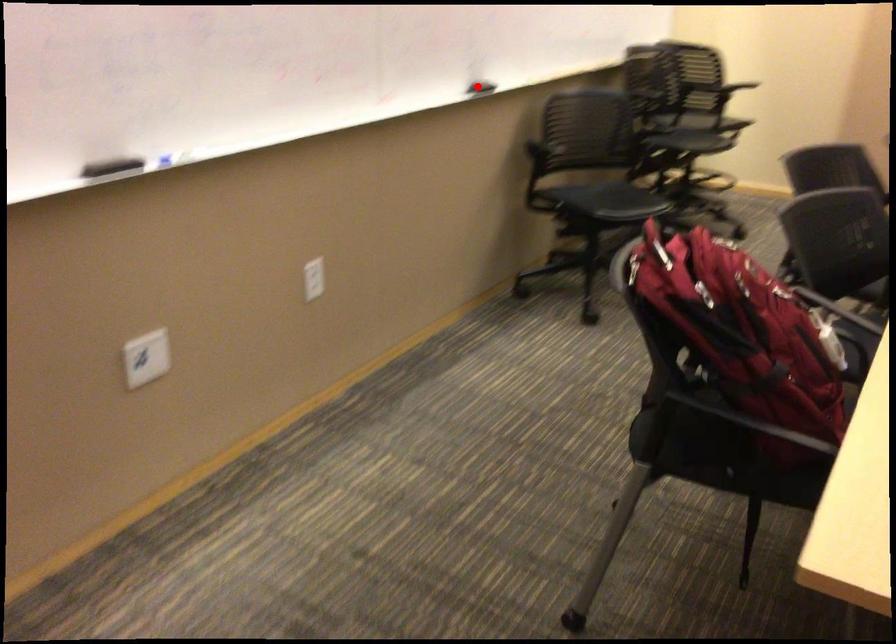
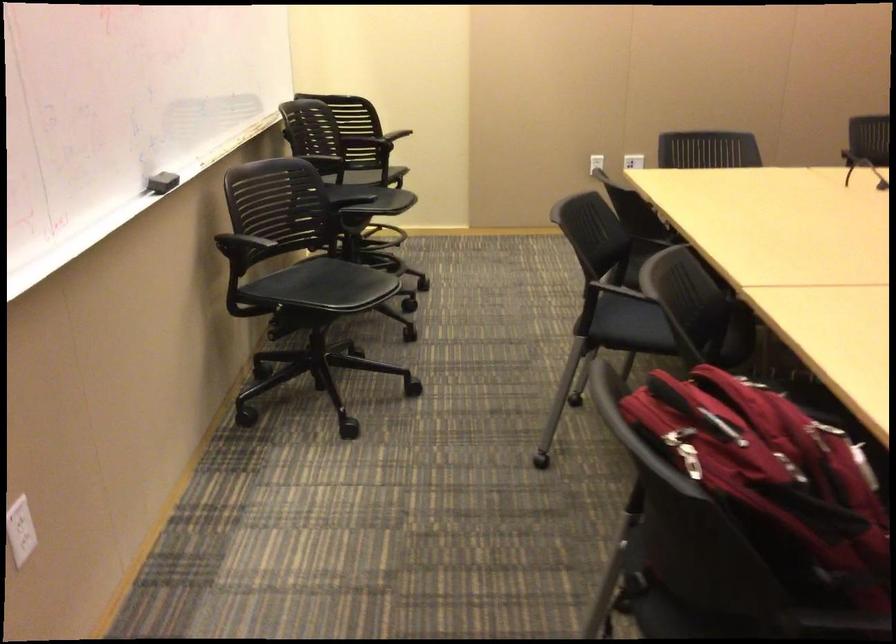
Question: I am providing you with two images of the same scene from different viewpoints. Given a red point in image1, look at the same physical point in image2. Is it:

Choices:
 (A) Closer to the viewpoint
 (B) Farther from the viewpoint

Answer: (A)